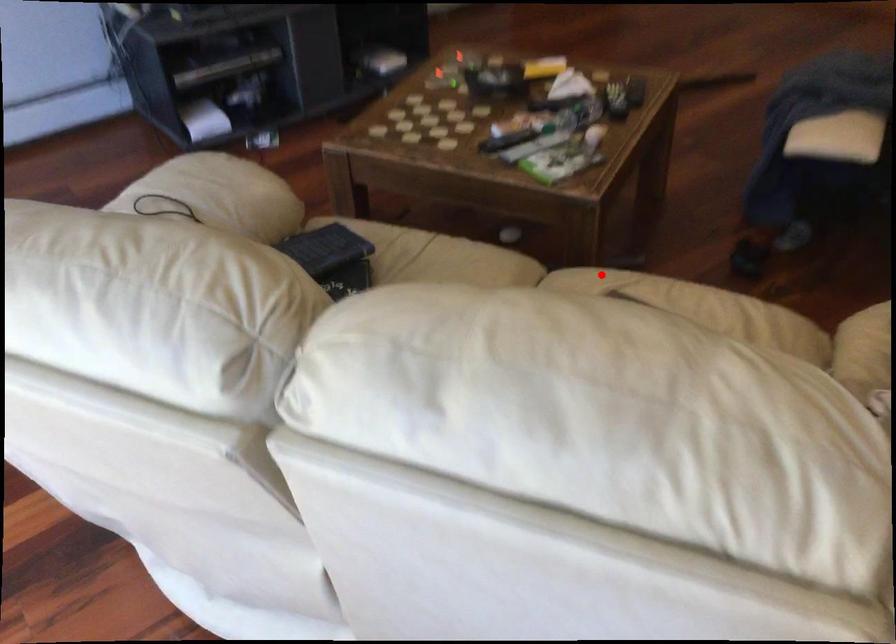
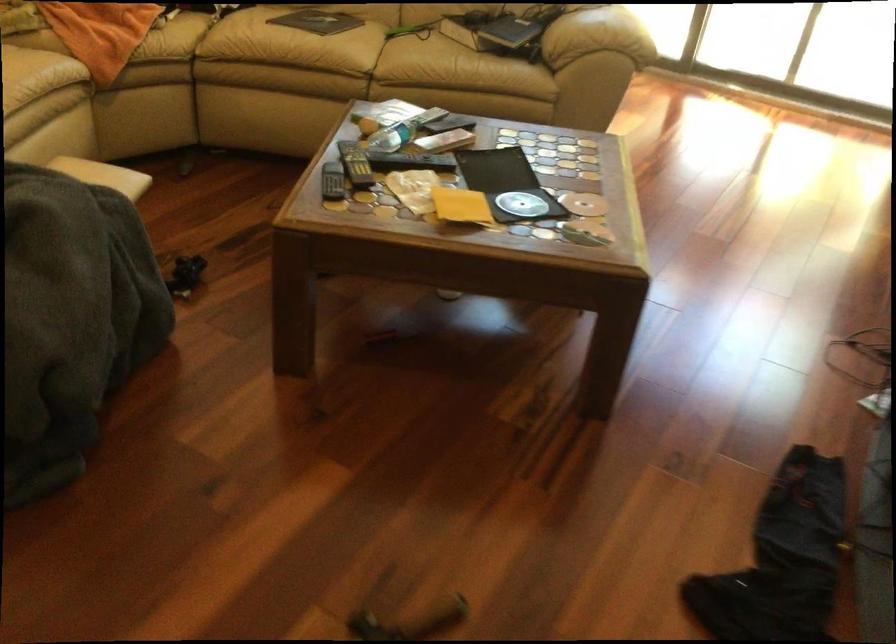
In the second image, find the point that corresponds to the highlighted location in the first image.

(334, 58)